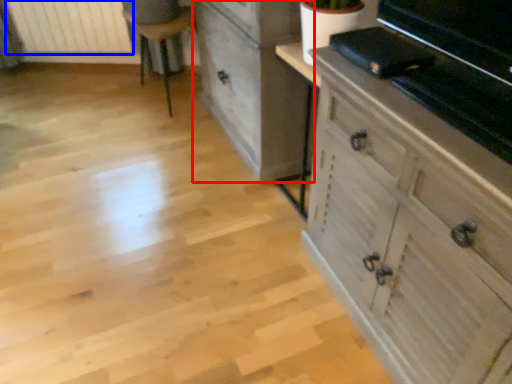
Question: Which of the following is the farthest to the observer, chest of drawers (highlighted by a red box) or radiator (highlighted by a blue box)?

Choices:
 (A) chest of drawers
 (B) radiator

Answer: (B)